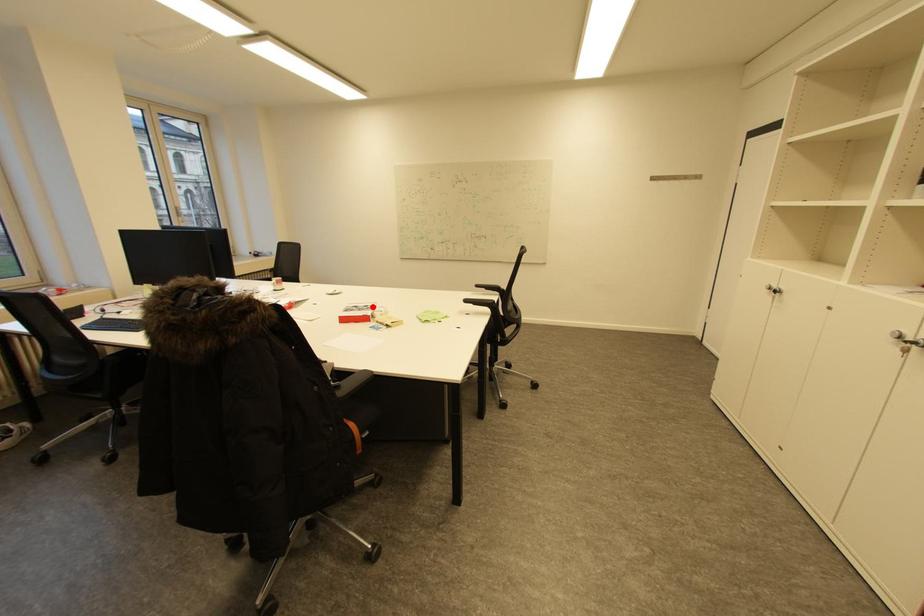
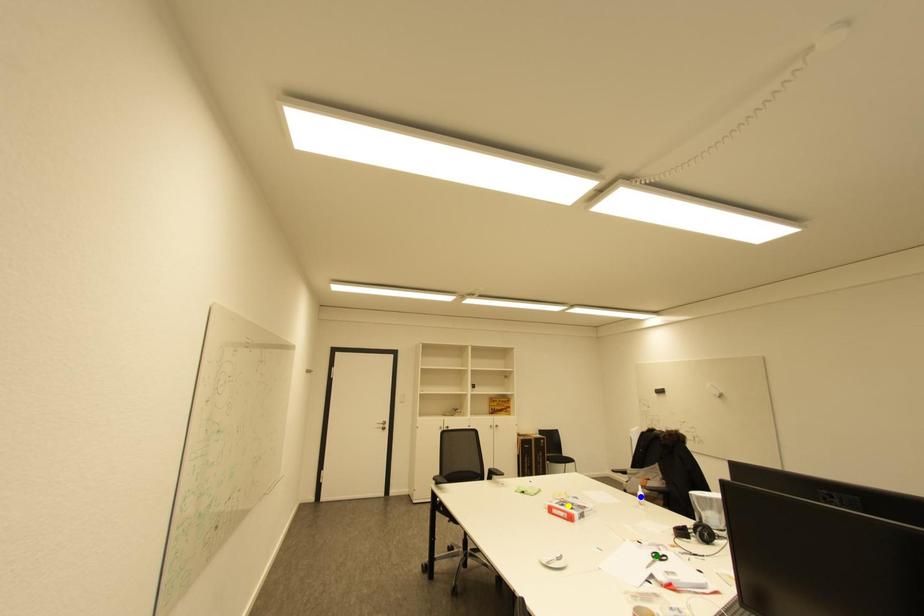
Question: I am providing you with two images of the same scene from different viewpoints. A red point is marked on the first image. You are given multiple points on the second image. Which mark in image 2 goes with the point in image 1?

Choices:
 (A) blue point
 (B) green point
 (C) yellow point

Answer: (C)